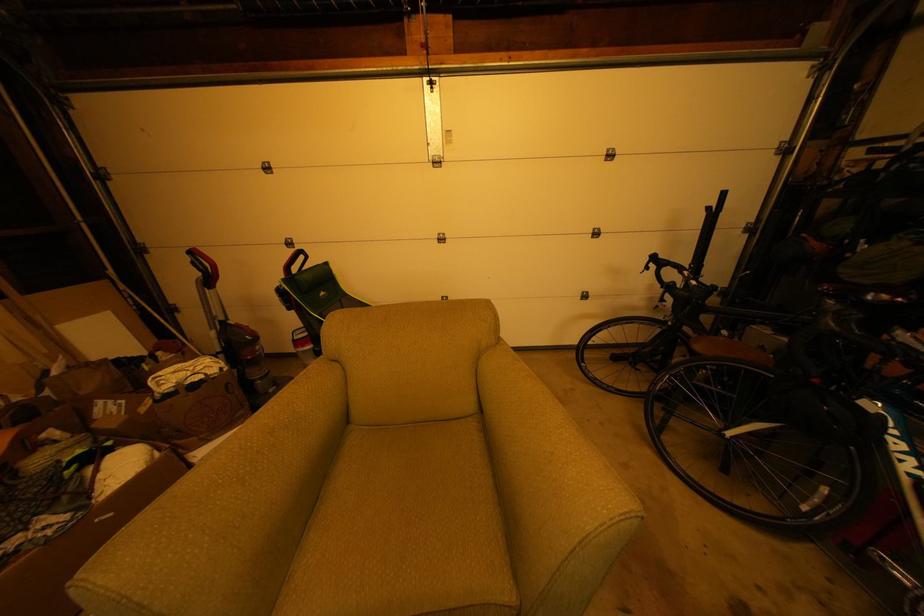
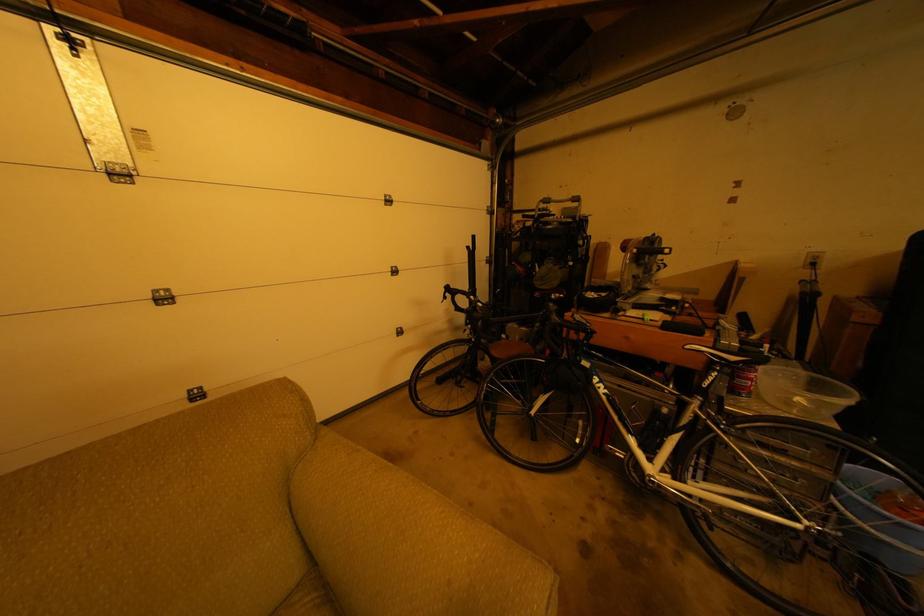
Question: The camera is either moving clockwise (left) or counter-clockwise (right) around the object. The first image is from the beginning of the video and the second image is from the end. Is the camera moving left or right when shooting the video?

Choices:
 (A) Left
 (B) Right

Answer: (A)